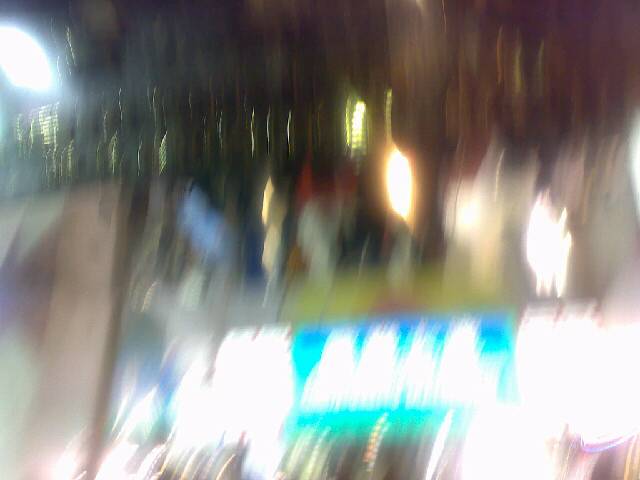
The image size is (640, 480). I want to click on edge of wooden pillar, so click(x=125, y=223), click(x=114, y=333), click(x=98, y=440).